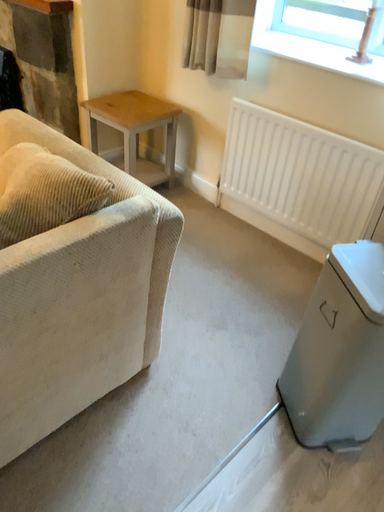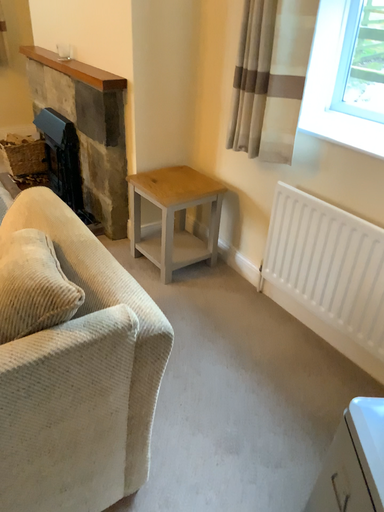
Question: How did the camera likely rotate when shooting the video?

Choices:
 (A) rotated downward
 (B) rotated upward

Answer: (B)